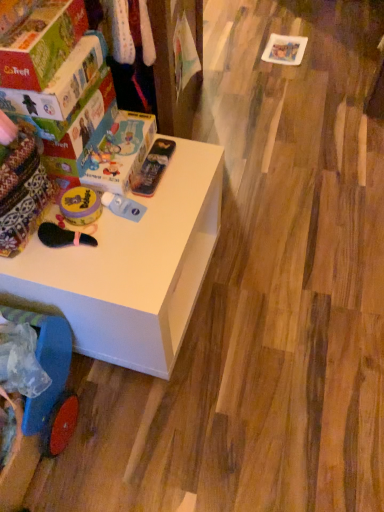
The width and height of the screenshot is (384, 512). In order to click on vacant space in front of yellow matte container at left, arranged as the third toy when viewed from the right in this screenshot , I will do `click(89, 262)`.